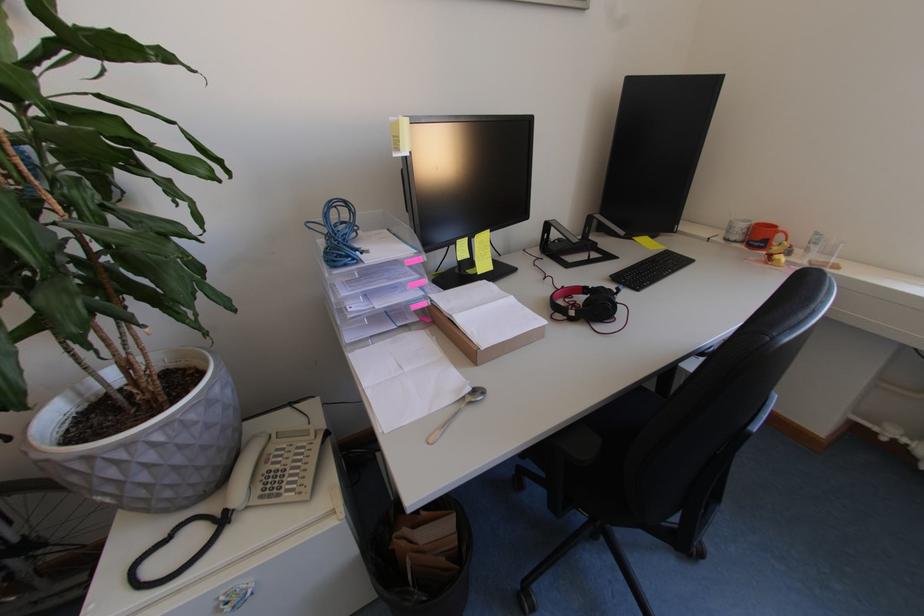
Find where to lift the white telephone handset. Please return your answer as a coordinate pair (x, y).

(244, 472)